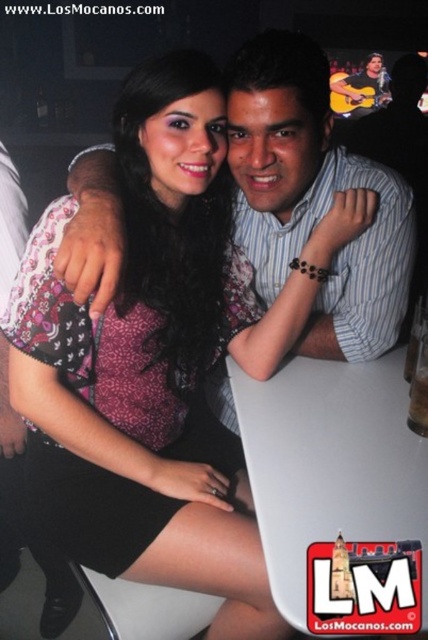
Question: Which point is farther to the camera?

Choices:
 (A) click(413, 208)
 (B) click(369, 67)

Answer: (B)

Question: Does matte striped shirt at center have a lesser width compared to smooth brown guitar at upper right?

Choices:
 (A) no
 (B) yes

Answer: (B)

Question: Does matte striped shirt at center appear over smooth brown guitar at upper right?

Choices:
 (A) yes
 (B) no

Answer: (B)

Question: Is matte striped shirt at center behind smooth brown guitar at upper right?

Choices:
 (A) yes
 (B) no

Answer: (B)

Question: Which point is farther to the camera?

Choices:
 (A) smooth brown guitar at upper right
 (B) matte striped shirt at center

Answer: (A)